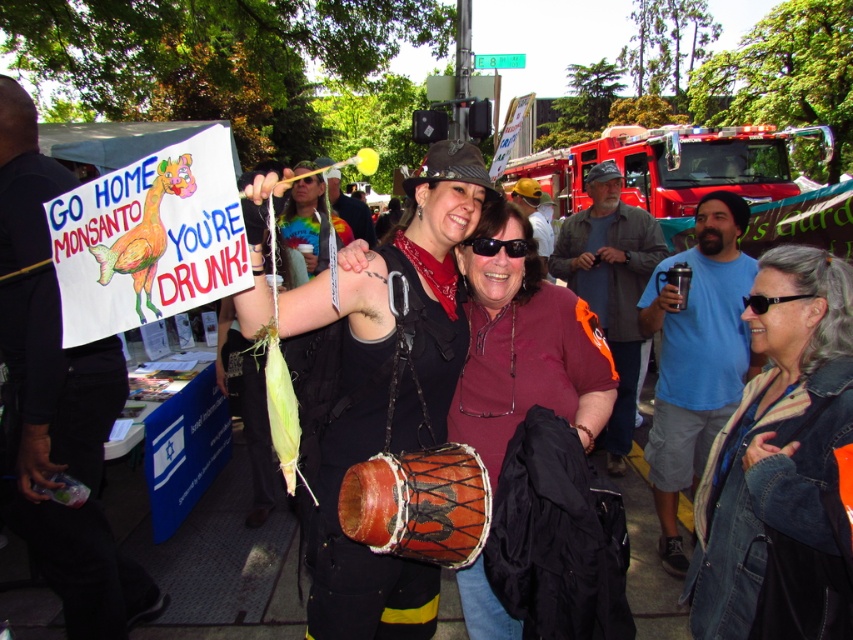
Between black shirt at left and maroon fabric shirt at center, which one is positioned lower?

Positioned lower is black shirt at left.

Who is positioned more to the left, black shirt at left or maroon fabric shirt at center?

Positioned to the left is black shirt at left.

Identify the location of black shirt at left. (67, 460).

Is denim jacket at lower right to the left of leather drum at center from the viewer's perspective?

No, denim jacket at lower right is not to the left of leather drum at center.

Between denim jacket at lower right and leather drum at center, which one has more height?

denim jacket at lower right

The image size is (853, 640). What do you see at coordinates (781, 465) in the screenshot?
I see `denim jacket at lower right` at bounding box center [781, 465].

Locate an element on the screen. The height and width of the screenshot is (640, 853). denim jacket at lower right is located at coordinates (781, 465).

Does denim jacket at lower right appear under denim jacket at center?

Correct, denim jacket at lower right is located below denim jacket at center.

Which is more to the right, denim jacket at lower right or denim jacket at center?

From the viewer's perspective, denim jacket at center appears more on the right side.

What are the coordinates of `denim jacket at lower right` in the screenshot? It's located at pos(781,465).